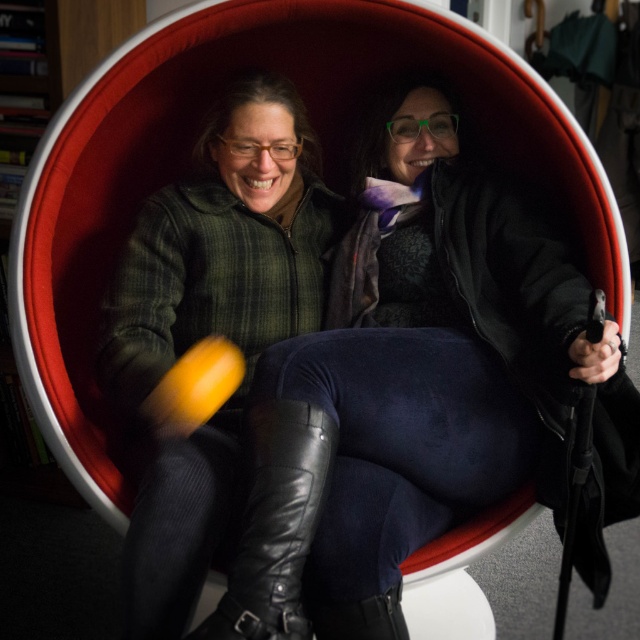
Is point (307, 308) positioned before point (285, 467)?

No.

Is point (237, 211) positioned behind point (328, 452)?

Yes, point (237, 211) is behind point (328, 452).

Is point (273, 198) positioned in front of point (268, 492)?

No, it is not.

I want to click on green plaid jacket at left, so click(x=211, y=324).